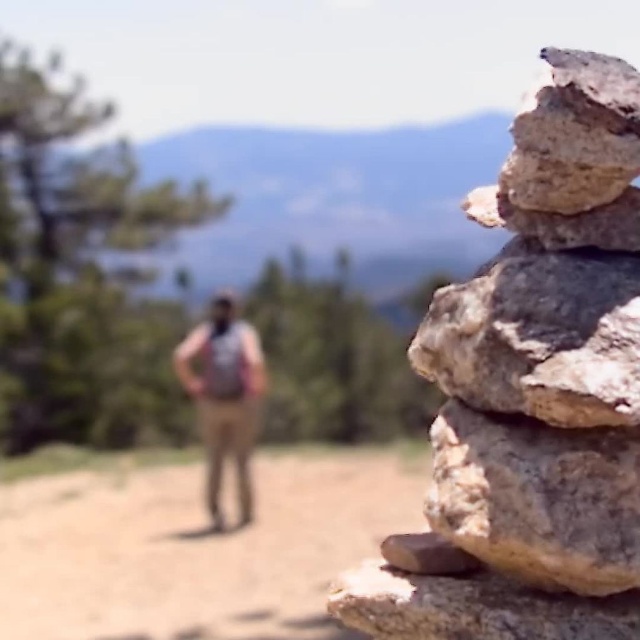
Question: Does green leafy pine at upper left lie behind tan fabric pants at center?

Choices:
 (A) no
 (B) yes

Answer: (B)

Question: Can you confirm if gray rough rock at right is positioned to the right of tan fabric pants at center?

Choices:
 (A) yes
 (B) no

Answer: (A)

Question: Among these points, which one is farthest from the camera?

Choices:
 (A) (554, 420)
 (B) (208, 488)
 (C) (529, 476)
 (D) (573, 445)

Answer: (B)

Question: Among these objects, which one is nearest to the camera?

Choices:
 (A) rough textured rock at right
 (B) tan fabric pants at center
 (C) gray rough rock at right

Answer: (A)

Question: Is green leafy pine at upper left wider than gray rough rock at right?

Choices:
 (A) no
 (B) yes

Answer: (B)

Question: Which of the following is the closest to the observer?

Choices:
 (A) gray rough rock at right
 (B) green leafy pine at upper left
 (C) tan fabric pants at center
 (D) rough textured rock at right

Answer: (D)